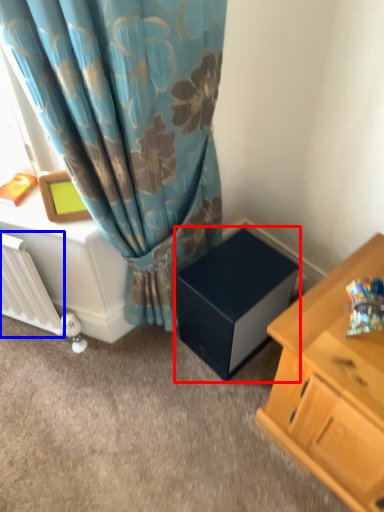
Question: Which of the following is the farthest to the observer, cardboard box (highlighted by a red box) or radiator (highlighted by a blue box)?

Choices:
 (A) cardboard box
 (B) radiator

Answer: (A)